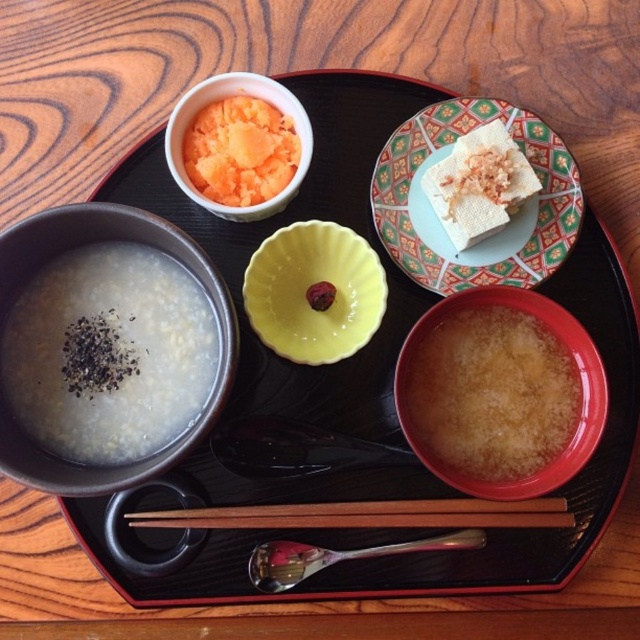
You are a drone operator trying to capture a close shot of the black tray with red edges. You need to position your drone at a specific height to focus on the point at coordinates point (353, 337). According to the scene description, what is the recommended height in inches for your drone to achieve optimal focus on this point?

The recommended height for the drone to achieve optimal focus on the point point (353, 337) is 35.25 inches, as this is the distance specified between the point and the camera.

You are a delivery robot positioned at the center of the wooden table. You need to deliver a small item to the point marked as point (317, 221) and then to point (595, 406). Which point should you visit first to ensure you can reach both without moving around the table?

You should visit point (595, 406) first because point (317, 221) is behind it. By reaching the front point first, you can then move backward to access the point behind without obstruction.

You are a guest at a traditional Japanese meal and need to use the brown wood chopsticks at center. Where should you place your hands to hold them properly?

To hold the brown wood chopsticks at center properly, position your dominant hand near the pointed end, approximately 1 to 2 inches from the tip, and rest your non dominant hand near the base. This allows for better control and precision while eating.